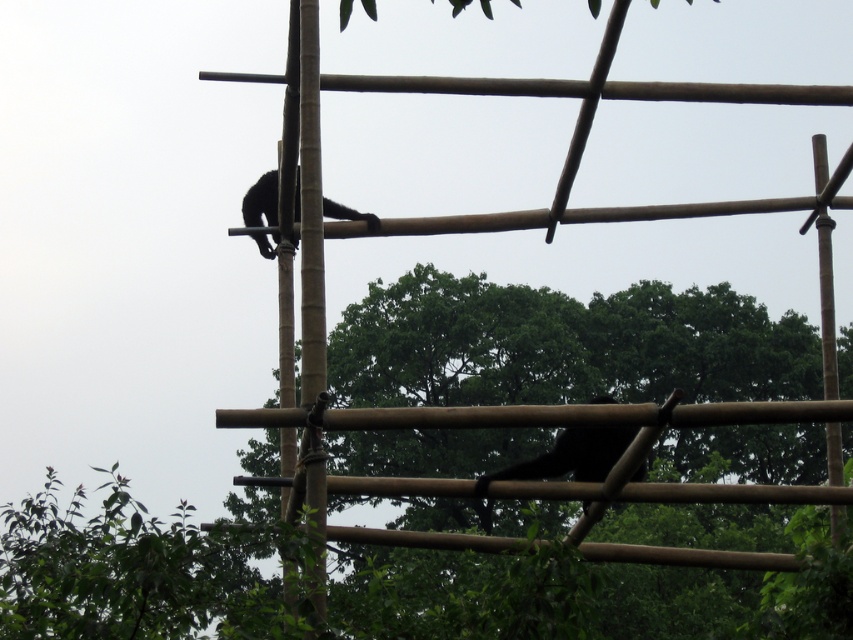
Between brown bamboo pole at upper left and black fur monkey at upper center, which one appears on the left side from the viewer's perspective?

From the viewer's perspective, black fur monkey at upper center appears more on the left side.

Is brown bamboo pole at upper left smaller than black fur monkey at upper center?

Yes, brown bamboo pole at upper left is smaller than black fur monkey at upper center.

Looking at this image, who is more distant from viewer, (306, 401) or (260, 234)?

The point (260, 234) is more distant.

Where is `brown bamboo pole at upper left`? The width and height of the screenshot is (853, 640). brown bamboo pole at upper left is located at coordinates (312, 305).

Who is more distant from viewer, (706, 349) or (604, 435)?

The point (706, 349) is more distant.

Identify the location of green leafy tree at center. (561, 346).

What are the coordinates of `green leafy tree at center` in the screenshot? It's located at pos(561,346).

Find the location of `green leafy tree at center`. green leafy tree at center is located at coordinates (561, 346).

Is green leafy tree at center positioned behind black fur monkey at upper center?

No, it is not.

At what (x,y) coordinates should I click in order to perform the action: click on green leafy tree at center. Please return your answer as a coordinate pair (x, y). Looking at the image, I should click on (561, 346).

This screenshot has height=640, width=853. Identify the location of green leafy tree at center. (561, 346).